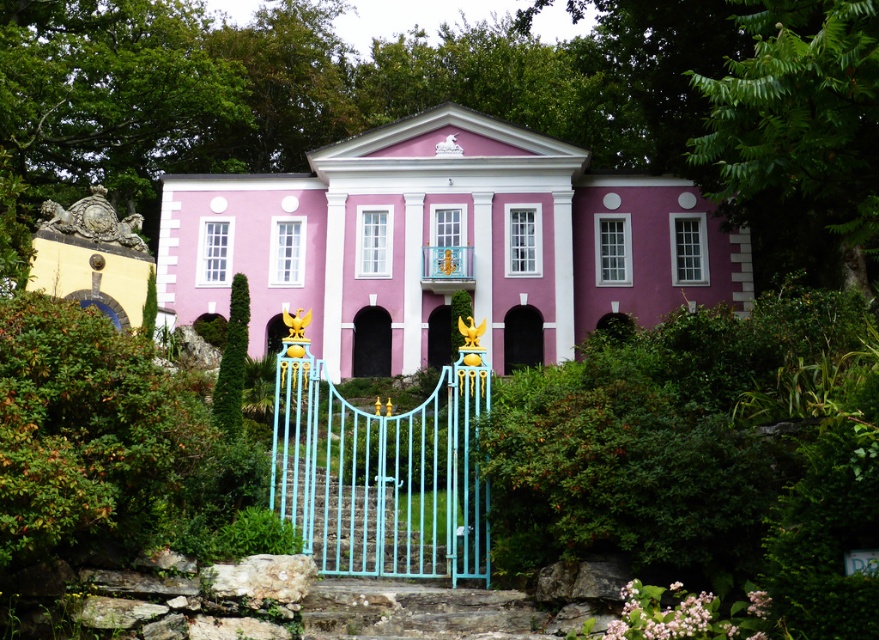
You are a tour guide leading a group to the entrance of the building. The entrance is marked by a grand light blue wrought iron gate with golden accents. You need to inform your group about the distance between the pink matte door at center and the black stone archway at center. What do you tell them?

The pink matte door at center is 43.64 feet away from the black stone archway at center.

You are a visitor arriving at the building and want to enter through the front entrance. Which object should you approach first, the light blue painted metal gate at center or the pink matte door at center?

The light blue painted metal gate at center is in front of the pink matte door at center, so you should approach the light blue painted metal gate at center first to enter the building.

You are a visitor approaching the building and see the rustic stone stairs at center and the black stone archway at center. Which object is positioned to the left of the other?

The rustic stone stairs at center are to the left of the black stone archway at center.